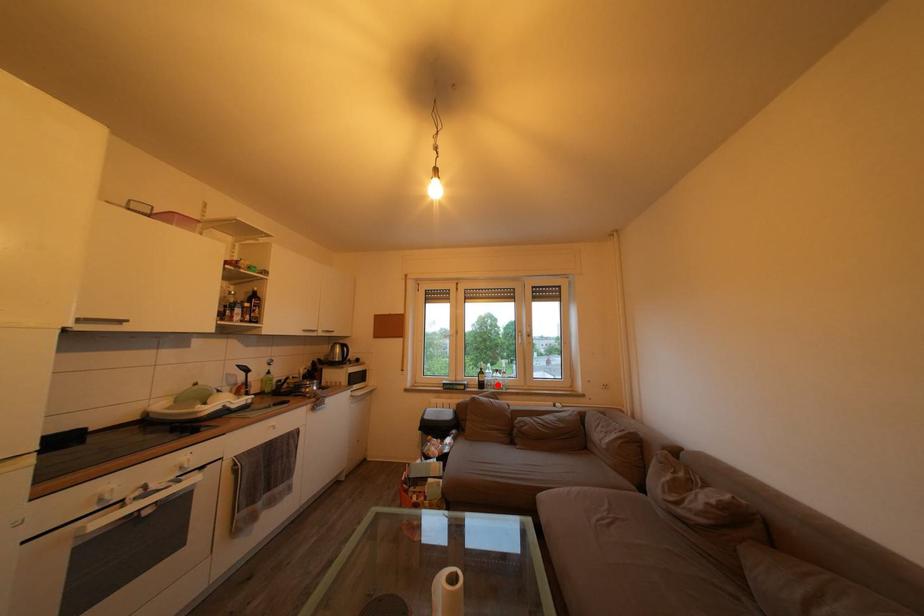
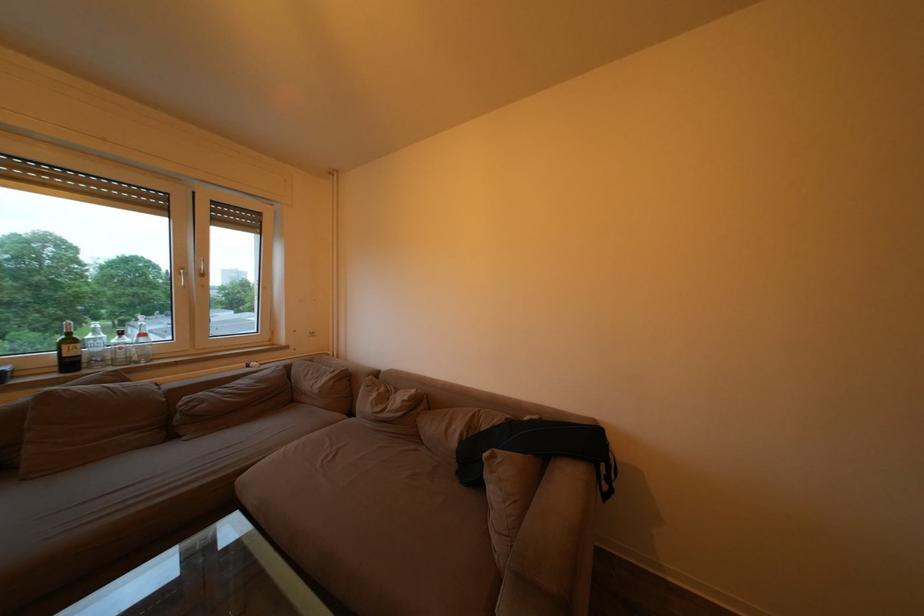
Question: A red point is marked in image1. In image2, is the corresponding 3D point closer to the camera or farther? Reply with the corresponding letter.

Choices:
 (A) The corresponding 3D point is closer.
 (B) The corresponding 3D point is farther.

Answer: (A)